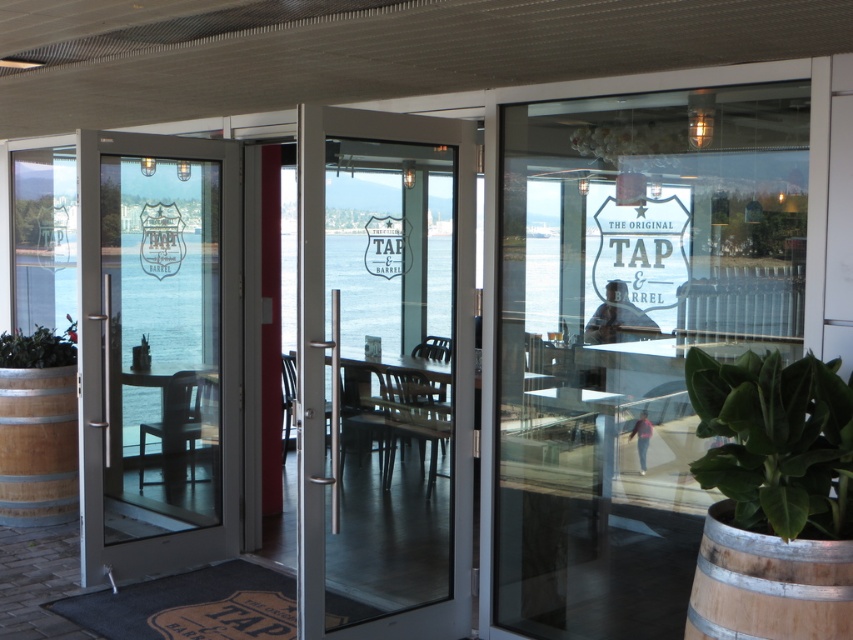
In the scene shown: You are a delivery person trying to enter The Original Tap Barrel. You see the clear glass door at left and the green leafy plant at lower right. Which object is taller?

The clear glass door at left is taller than the green leafy plant at lower right.